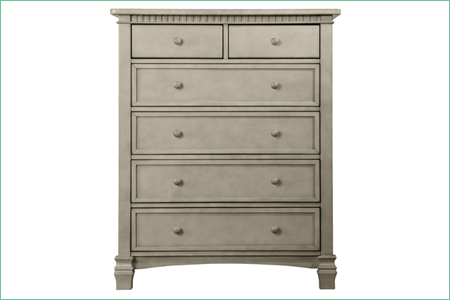
The height and width of the screenshot is (300, 450). In order to click on curved wood under bottom drawer in this screenshot , I will do `click(139, 263)`, `click(207, 259)`, `click(307, 263)`.